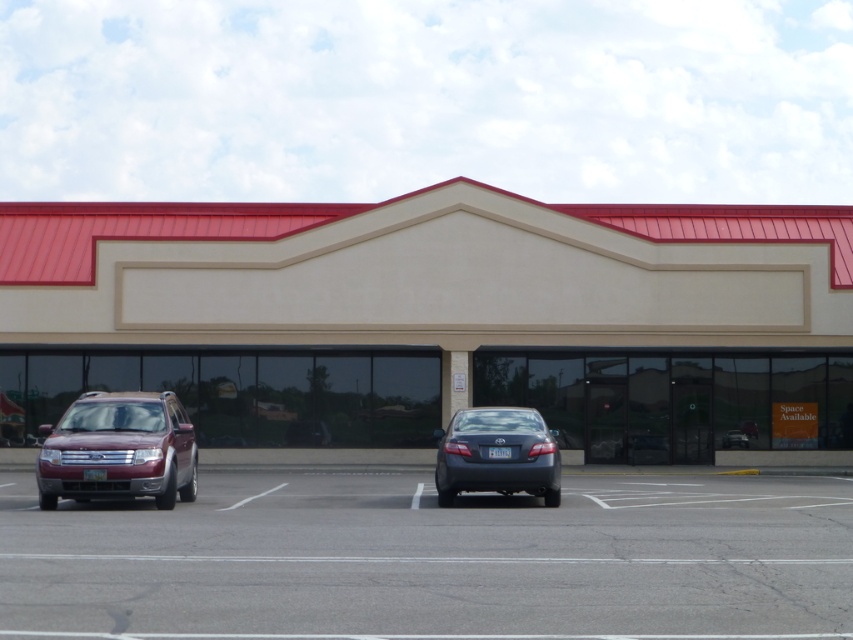
Who is positioned more to the right, gray asphalt parking lot at center or gray metallic sedan at center?

gray metallic sedan at center

Does gray asphalt parking lot at center have a lesser height compared to gray metallic sedan at center?

No, gray asphalt parking lot at center is not shorter than gray metallic sedan at center.

The width and height of the screenshot is (853, 640). What are the coordinates of `gray asphalt parking lot at center` in the screenshot? It's located at (434, 560).

Between point (122, 451) and point (471, 410), which one is positioned in front?

Point (122, 451)

Who is lower down, shiny maroon suv at left or gray metallic sedan at center?

gray metallic sedan at center

Is point (44, 484) positioned in front of point (527, 472)?

Yes.

Find the location of a particular element. Image resolution: width=853 pixels, height=640 pixels. shiny maroon suv at left is located at coordinates (119, 449).

Can you confirm if beige smooth building at center is smaller than gray metallic sedan at center?

No.

Measure the distance between beige smooth building at center and camera.

A distance of 114.75 feet exists between beige smooth building at center and camera.

Measure the distance between beige smooth building at center and camera.

They are 34.97 meters apart.

This screenshot has height=640, width=853. Identify the location of beige smooth building at center. (439, 317).